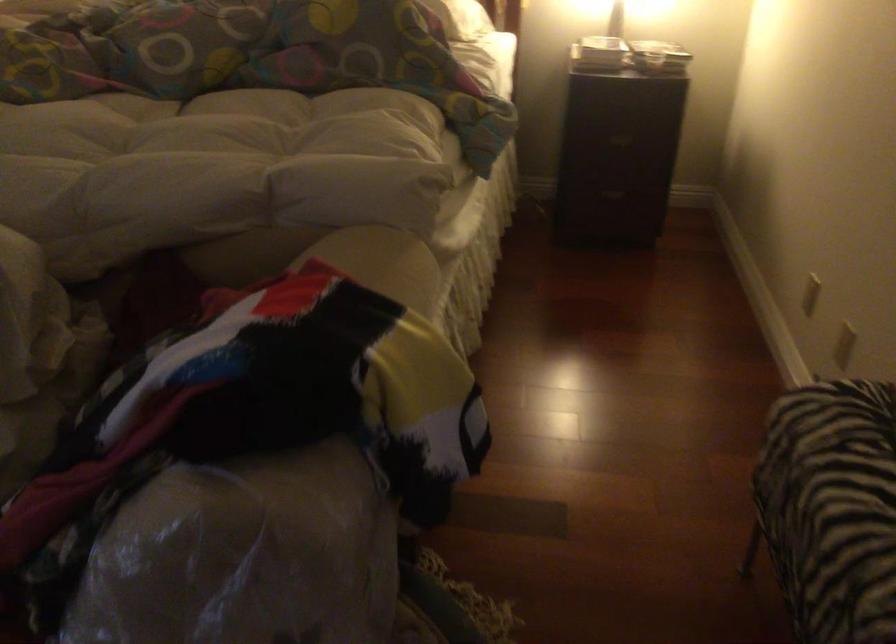
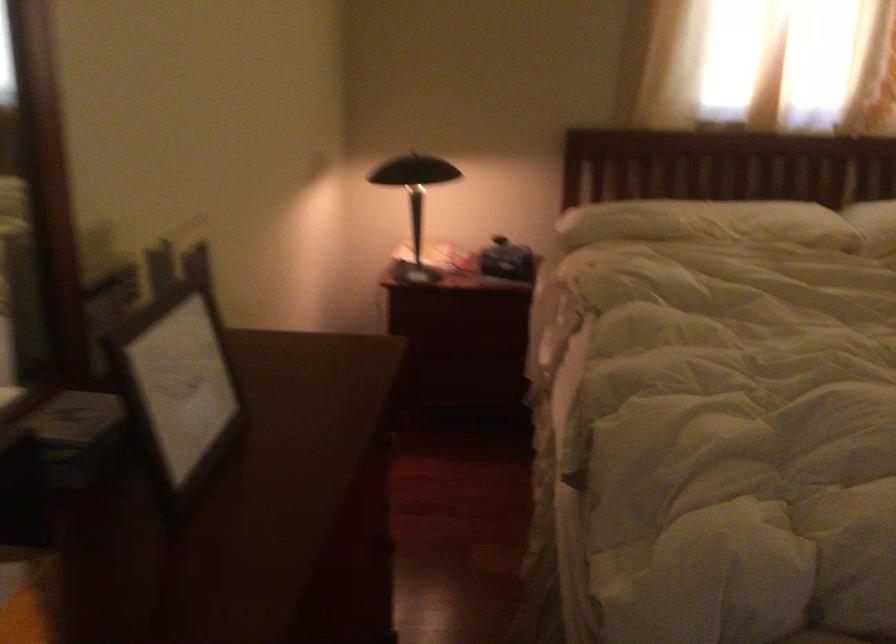
Question: The images are taken continuously from a first-person perspective. In which direction are you moving?

Choices:
 (A) Left
 (B) Right
 (C) Forward
 (D) Backward

Answer: (A)